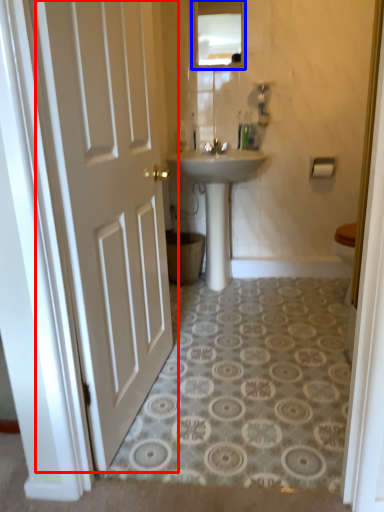
Question: Which point is closer to the camera, door (highlighted by a red box) or mirror (highlighted by a blue box)?

Choices:
 (A) door
 (B) mirror

Answer: (A)